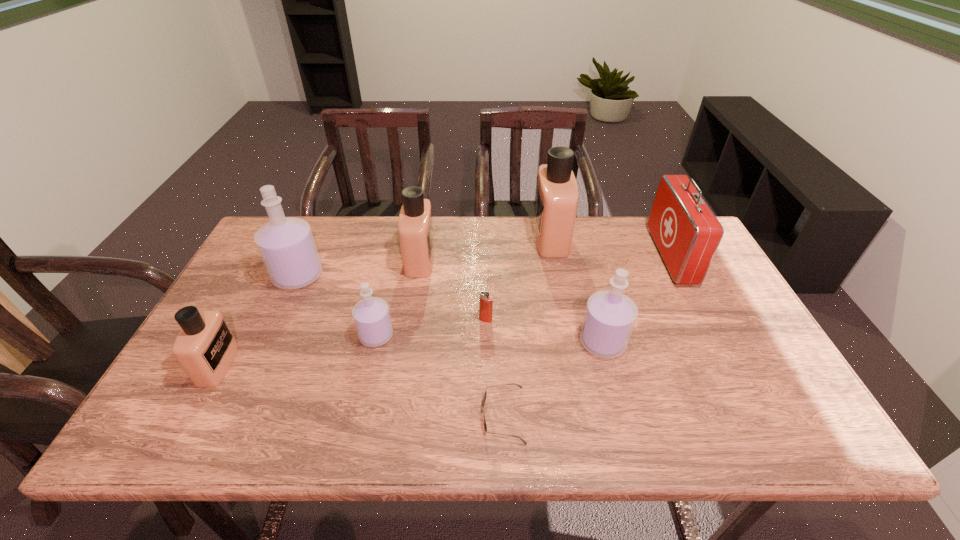
Locate an element on the screen. Image resolution: width=960 pixels, height=540 pixels. object that is positioned at the near edge is located at coordinates (485, 425).

Identify the location of object situated at the right edge. (686, 232).

Image resolution: width=960 pixels, height=540 pixels. Find the location of `object that is at the far left corner`. object that is at the far left corner is located at coordinates (286, 244).

Where is `object at the far right corner`? Image resolution: width=960 pixels, height=540 pixels. object at the far right corner is located at coordinates (686, 232).

You are a GUI agent. You are given a task and a screenshot of the screen. Output one action in this format:
    pyautogui.click(x=<x>, y=<y>)
    Task: Click on the vacant space at the far edge
    Image resolution: width=960 pixels, height=540 pixels.
    Given the screenshot: What is the action you would take?
    pyautogui.click(x=341, y=244)

Locate an element on the screen. The image size is (960, 540). vacant space at the near edge is located at coordinates (239, 417).

In the image, there is a desktop. Where is `vacant space at the right edge`? The image size is (960, 540). vacant space at the right edge is located at coordinates (712, 335).

In the image, there is a desktop. At what (x,y) coordinates should I click in order to perform the action: click on vacant space at the far left corner. Please return your answer as a coordinate pair (x, y). The height and width of the screenshot is (540, 960). Looking at the image, I should click on (313, 219).

In the image, there is a desktop. At what (x,y) coordinates should I click in order to perform the action: click on vacant region at the near left corner. Please return your answer as a coordinate pair (x, y). Looking at the image, I should click on pyautogui.click(x=220, y=423).

This screenshot has width=960, height=540. Identify the location of vacant space in between the second biggest purple perfume and the smallest purple perfume. (490, 339).